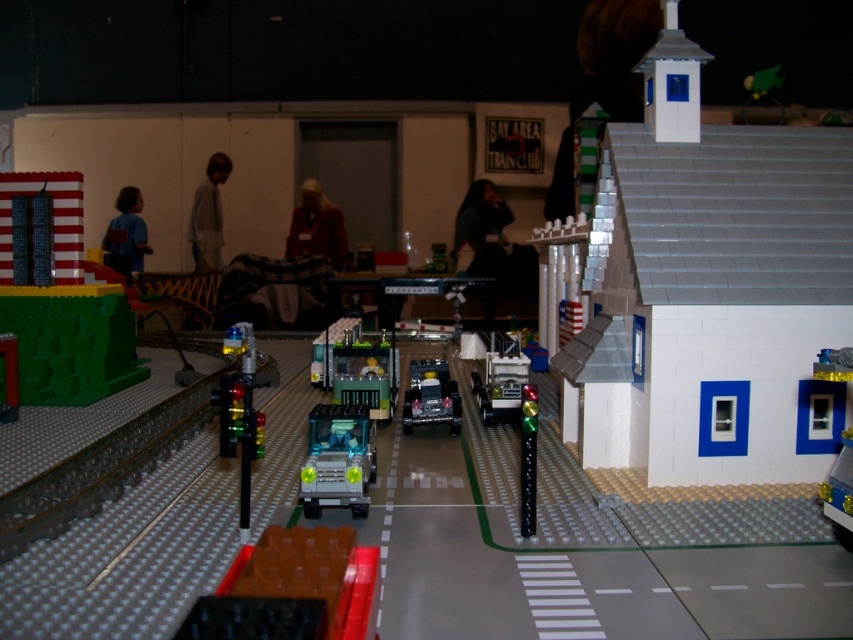
Question: Which point is farther to the camera?

Choices:
 (A) (332, 380)
 (B) (357, 426)
 (C) (102, 493)
 (D) (305, 624)

Answer: (A)

Question: Observing the image, what is the correct spatial positioning of translucent green plastic truck at center in reference to dark gray sweater at center?

Choices:
 (A) above
 (B) below

Answer: (B)

Question: Which of the following is the closest to the observer?

Choices:
 (A) (508, 356)
 (B) (329, 346)

Answer: (A)

Question: Among these points, which one is farthest from the camera?

Choices:
 (A) (354, 401)
 (B) (312, 184)
 (C) (108, 250)
 (D) (206, 268)

Answer: (D)

Question: In this image, where is translucent orange plastic at lower left located relative to metallic silver truck at center?

Choices:
 (A) above
 (B) below

Answer: (B)

Question: Can you confirm if dark gray sweater at center is positioned to the right of gold metallic train at center?

Choices:
 (A) yes
 (B) no

Answer: (B)